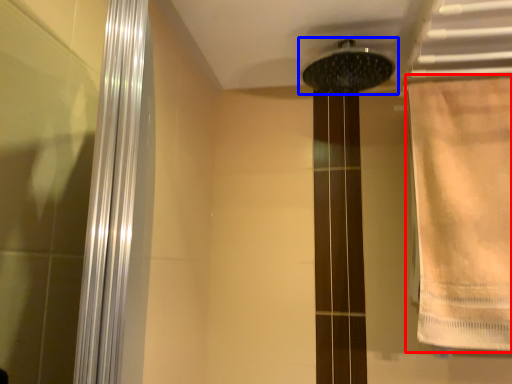
Question: Among these objects, which one is nearest to the camera, shower curtain (highlighted by a red box) or shower (highlighted by a blue box)?

Choices:
 (A) shower curtain
 (B) shower

Answer: (A)